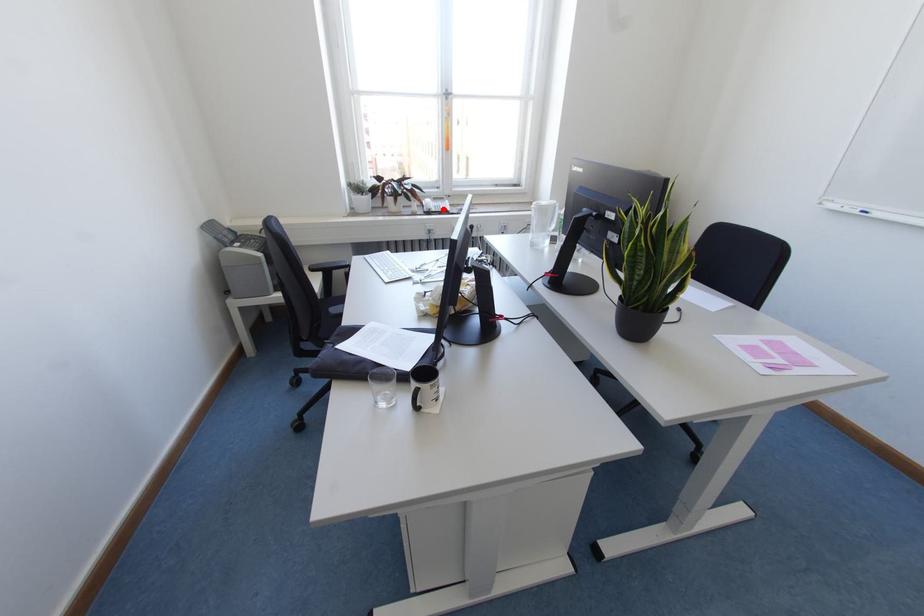
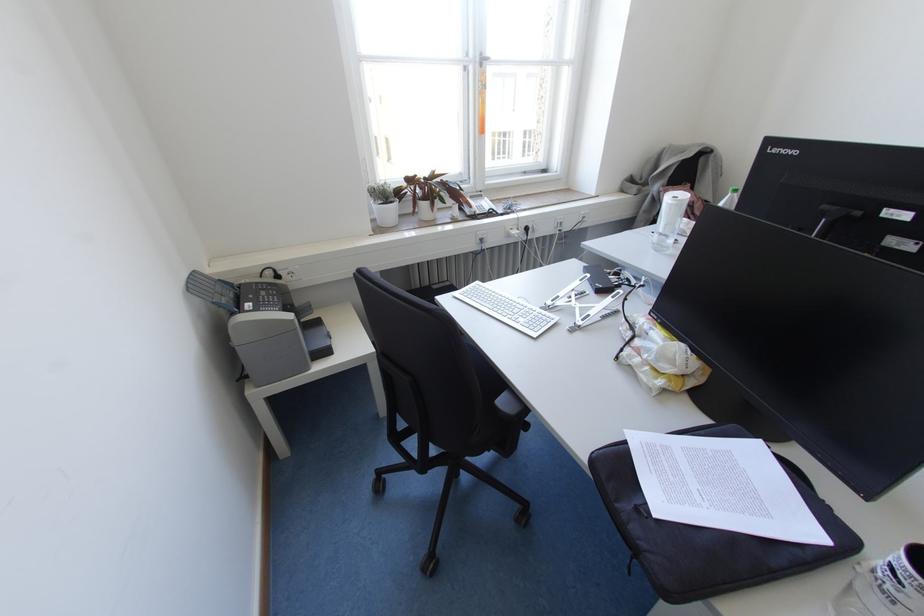
The point at the highlighted location is marked in the first image. Where is the corresponding point in the second image?

(490, 209)